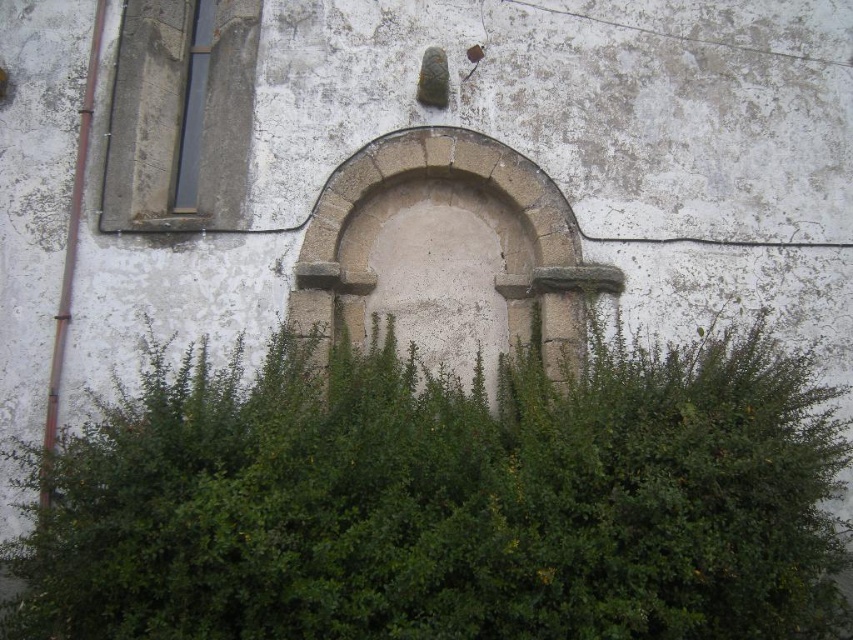
The image size is (853, 640). Find the location of `green leafy hedge at center`. green leafy hedge at center is located at coordinates (444, 500).

Locate an element on the screen. The width and height of the screenshot is (853, 640). green leafy hedge at center is located at coordinates (444, 500).

Where is `green leafy hedge at center`? The image size is (853, 640). green leafy hedge at center is located at coordinates (444, 500).

Which is behind, point (161, 200) or point (196, 150)?

Point (196, 150)

Is matte concrete window at upper left above smooth glass window at upper left?

No.

I want to click on matte concrete window at upper left, so click(x=178, y=116).

Is point (436, 128) farther from viewer compared to point (178, 173)?

No, it is not.

From the picture: Who is more forward, [578,248] or [178,134]?

Positioned in front is point [578,248].

Is point (426, 188) less distant than point (183, 116)?

Yes, it is.

Locate an element on the screen. Image resolution: width=853 pixels, height=640 pixels. stone archway at center is located at coordinates (473, 209).